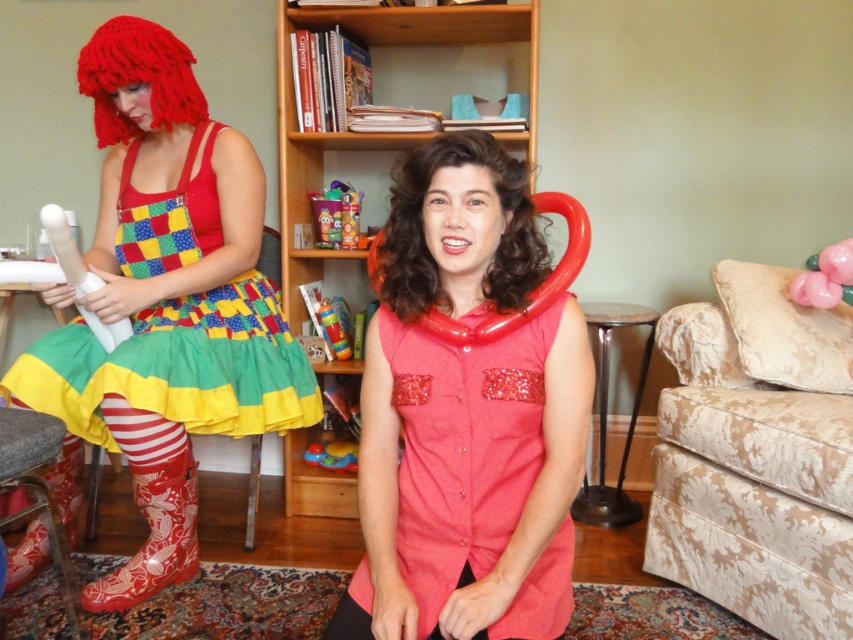
Which is more to the right, matte red blouse at center or rubber boot at lower left?

matte red blouse at center

Which of these two, matte red blouse at center or rubber boot at lower left, stands shorter?

With less height is rubber boot at lower left.

Which is in front, point (445, 596) or point (64, 458)?

Point (445, 596) is more forward.

Where is `matte red blouse at center`? matte red blouse at center is located at coordinates [x=466, y=413].

Which is more to the left, wooden bookshelf at center or rubber duck at center?

From the viewer's perspective, rubber duck at center appears more on the left side.

Between point (526, 17) and point (308, 454), which one is positioned behind?

Positioned behind is point (308, 454).

Does point (366, 8) lie behind point (350, 456)?

That is False.

Locate an element on the screen. The width and height of the screenshot is (853, 640). wooden bookshelf at center is located at coordinates (386, 132).

Between point (492, 269) and point (329, 314), which one is positioned in front?

Positioned in front is point (492, 269).

Can you confirm if matte red blouse at center is thinner than rubberized plastic cup at center?

No.

Between point (560, 422) and point (332, 333), which one is positioned behind?

Positioned behind is point (332, 333).

This screenshot has height=640, width=853. I want to click on matte red blouse at center, so click(x=466, y=413).